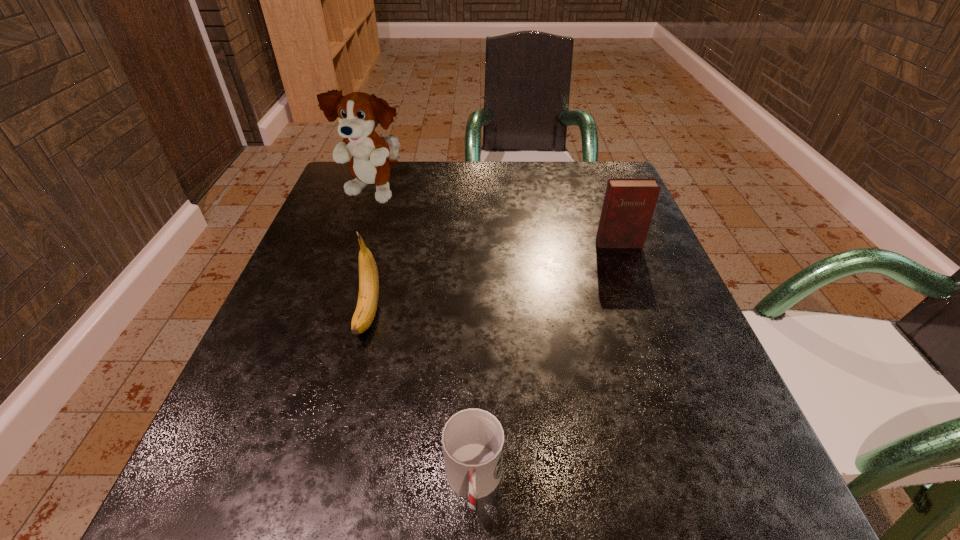
Identify the location of object at the far edge. The width and height of the screenshot is (960, 540). (359, 113).

In order to click on object that is positioned at the near edge in this screenshot , I will do [x=473, y=439].

Locate an element on the screen. The height and width of the screenshot is (540, 960). puppy located at the left edge is located at coordinates (359, 113).

Where is `banana that is at the left edge`? This screenshot has height=540, width=960. banana that is at the left edge is located at coordinates (364, 314).

I want to click on object that is at the right edge, so click(x=629, y=203).

Image resolution: width=960 pixels, height=540 pixels. In order to click on object that is at the far left corner in this screenshot , I will do `click(359, 113)`.

Where is `blank area at the far edge`? The height and width of the screenshot is (540, 960). blank area at the far edge is located at coordinates (420, 202).

Locate an element on the screen. Image resolution: width=960 pixels, height=540 pixels. vacant space at the near edge of the desktop is located at coordinates (419, 521).

Where is `free space at the left edge of the desktop`? This screenshot has height=540, width=960. free space at the left edge of the desktop is located at coordinates (317, 304).

In the image, there is a desktop. Where is `free region at the right edge`? free region at the right edge is located at coordinates (641, 401).